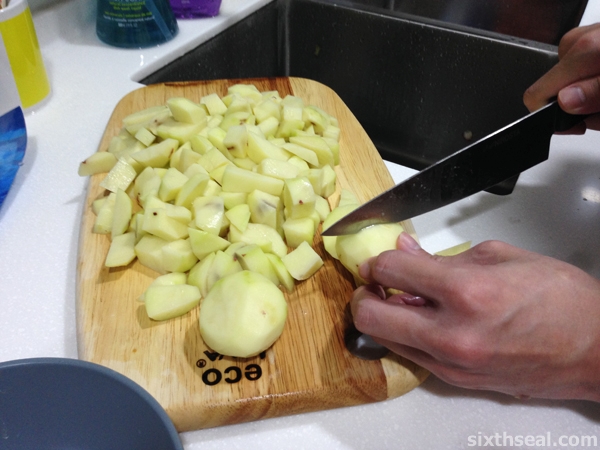
Locate an element on the screen. The image size is (600, 450). gray plastic bowl is located at coordinates (74, 401).